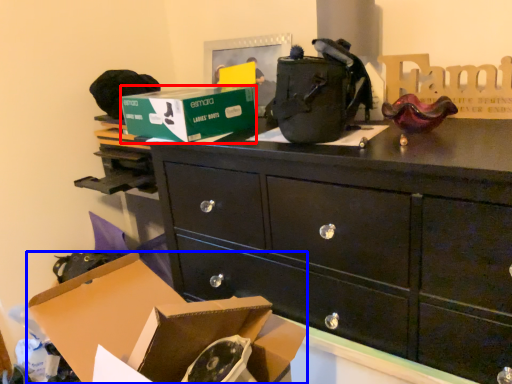
Question: Which point is further to the camera, box (highlighted by a red box) or box (highlighted by a blue box)?

Choices:
 (A) box
 (B) box

Answer: (A)